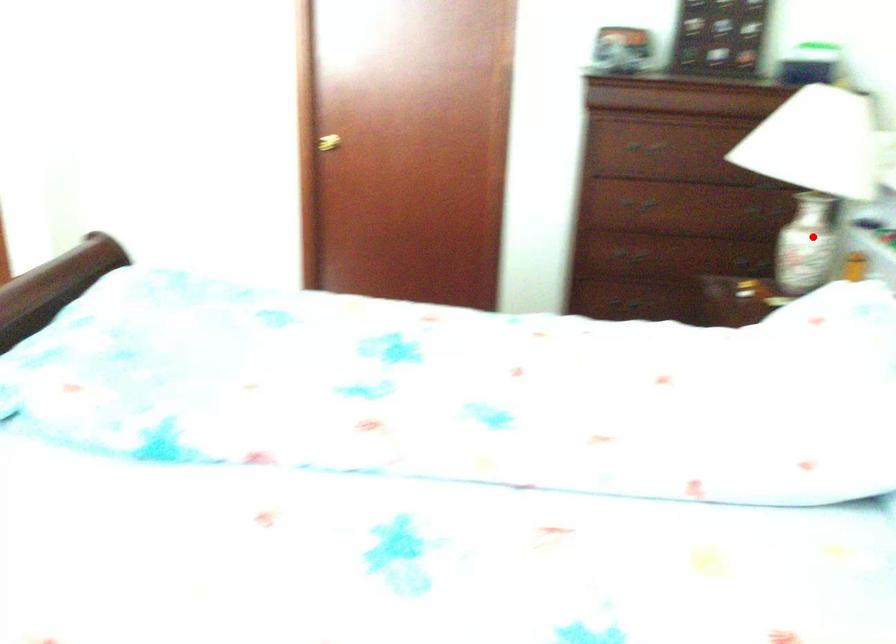
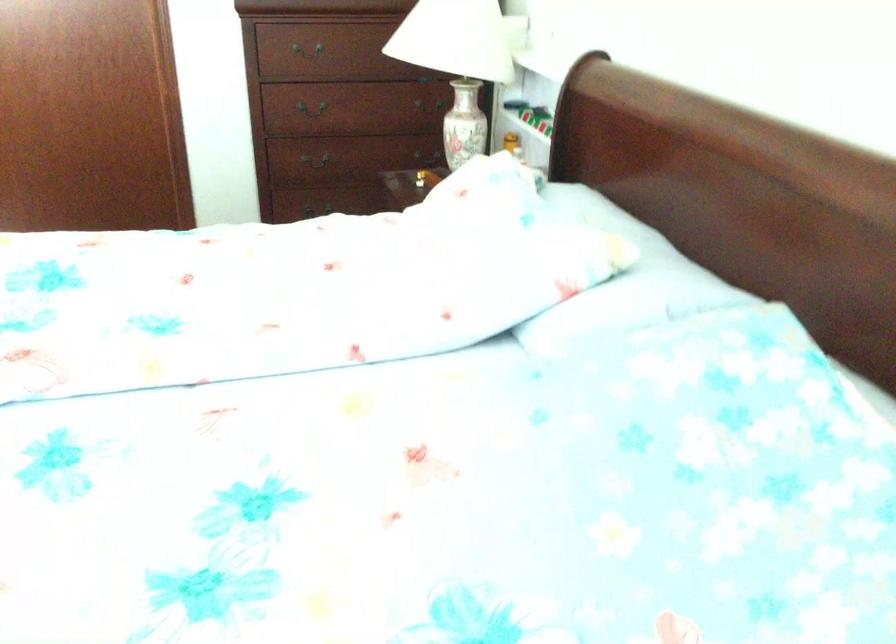
Question: I am providing you with two images of the same scene from different viewpoints. A red point is marked on the first image. At the location where the point appears in image 1, is it still visible in image 2?

Choices:
 (A) Yes
 (B) No

Answer: (A)